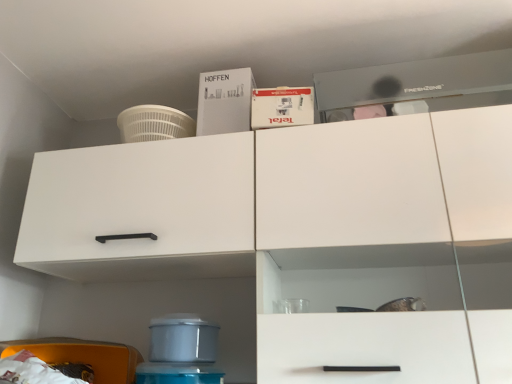
Question: Considering the positions of white matte cabinet at left and white cardboard box at upper center, the 2th box when ordered from left to right, in the image, is white matte cabinet at left taller or shorter than white cardboard box at upper center, the 2th box when ordered from left to right,?

Choices:
 (A) short
 (B) tall

Answer: (B)

Question: Is point (61, 228) positioned closer to the camera than point (287, 94)?

Choices:
 (A) closer
 (B) farther

Answer: (A)

Question: Which of these objects is positioned closest to the white cardboard box at upper center, which ranks as the first box in front-to-back order?

Choices:
 (A) white matte cabinet at left
 (B) white matte box at upper center, the 1th box in the back-to-front sequence

Answer: (B)

Question: Which is nearer to the white matte cabinet at left?

Choices:
 (A) white cardboard box at upper center, placed as the second box when sorted from back to front
 (B) white matte box at upper center, the 1th box in the back-to-front sequence

Answer: (B)